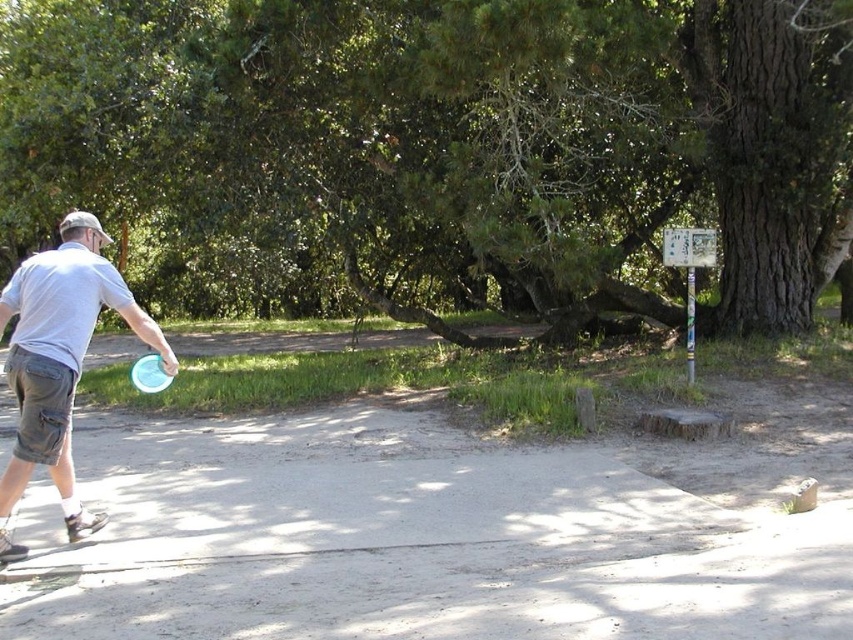
You are a drone operator trying to capture a photo of the person throwing the blue frisbee. The drone is currently at the position of the green leafy tree at upper center. To get the best shot, you need to move the drone 0.1 units to the right and 0.05 units downward. Will the drone still be within the frame of the image?

The green leafy tree at upper center is at point (445, 147). Moving 0.1 to the right would bring it to 0.330, and 0.05 downward to 0.473. Since these coordinates are within the standard 0 to 1 range, the drone will remain in frame.

You are playing frisbee in the park and see two frisbees on the ground, the white matte frisbee at left and the blue plastic frisbee at left. If you want to pick up the closer one to you, which one should you choose?

Both frisbees are at the same location since they are both at left, so you can choose either one.